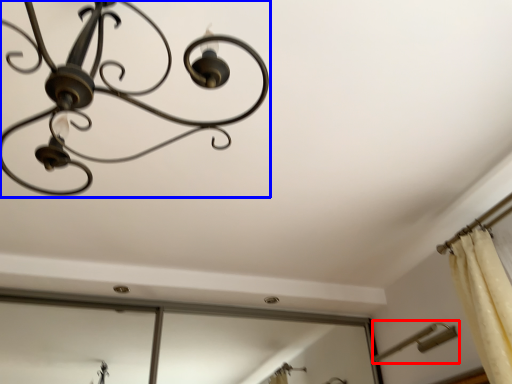
Question: Among these objects, which one is farthest to the camera, lamp (highlighted by a red box) or lamp (highlighted by a blue box)?

Choices:
 (A) lamp
 (B) lamp

Answer: (A)